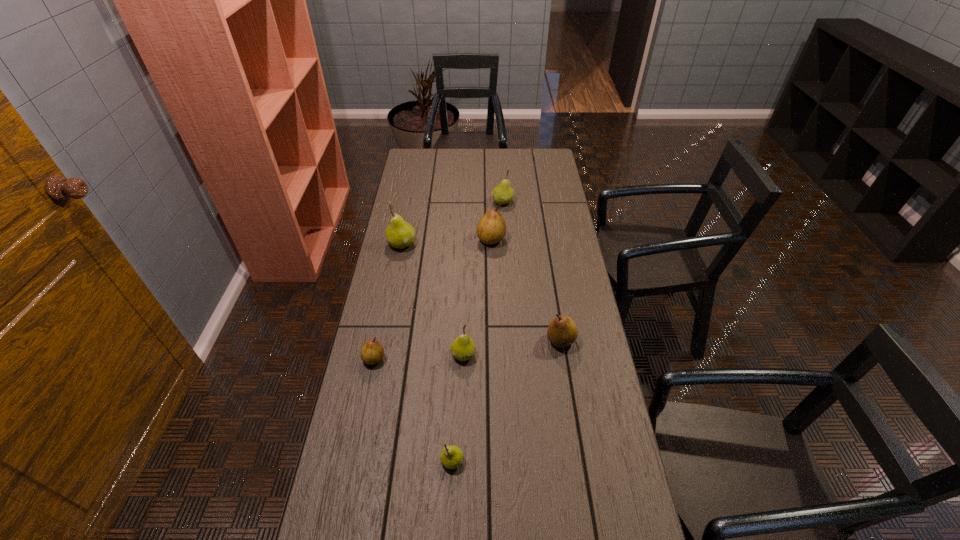
In the image, there is a desktop. Find the location of `free space at the far edge`. free space at the far edge is located at coordinates (523, 160).

You are a GUI agent. You are given a task and a screenshot of the screen. Output one action in this format:
    pyautogui.click(x=<x>, y=<y>)
    Task: Click on the free location at the left edge
    The width and height of the screenshot is (960, 540).
    Given the screenshot: What is the action you would take?
    pyautogui.click(x=390, y=375)

Locate an element on the screen. free space at the right edge is located at coordinates (564, 255).

You are a GUI agent. You are given a task and a screenshot of the screen. Output one action in this format:
    pyautogui.click(x=<x>, y=<y>)
    Task: Click on the vacant space at the far right corner
    
    Given the screenshot: What is the action you would take?
    pyautogui.click(x=544, y=172)

The width and height of the screenshot is (960, 540). I want to click on vacant space that is in between the third biggest green pear and the farthest object, so click(483, 278).

The height and width of the screenshot is (540, 960). What are the coordinates of `free spot between the biggest brown pear and the smallest brown pear` in the screenshot? It's located at (432, 299).

This screenshot has height=540, width=960. I want to click on vacant area that lies between the nearest pear and the third biggest green pear, so click(x=458, y=408).

Where is `unoccupied area between the second brown pear from left to right and the second nearest green pear`? unoccupied area between the second brown pear from left to right and the second nearest green pear is located at coordinates (477, 297).

Where is `vacant point located between the farthest pear and the tallest pear`? The width and height of the screenshot is (960, 540). vacant point located between the farthest pear and the tallest pear is located at coordinates (452, 223).

Where is `free point between the smallest brown pear and the second farthest green pear`? Image resolution: width=960 pixels, height=540 pixels. free point between the smallest brown pear and the second farthest green pear is located at coordinates (388, 301).